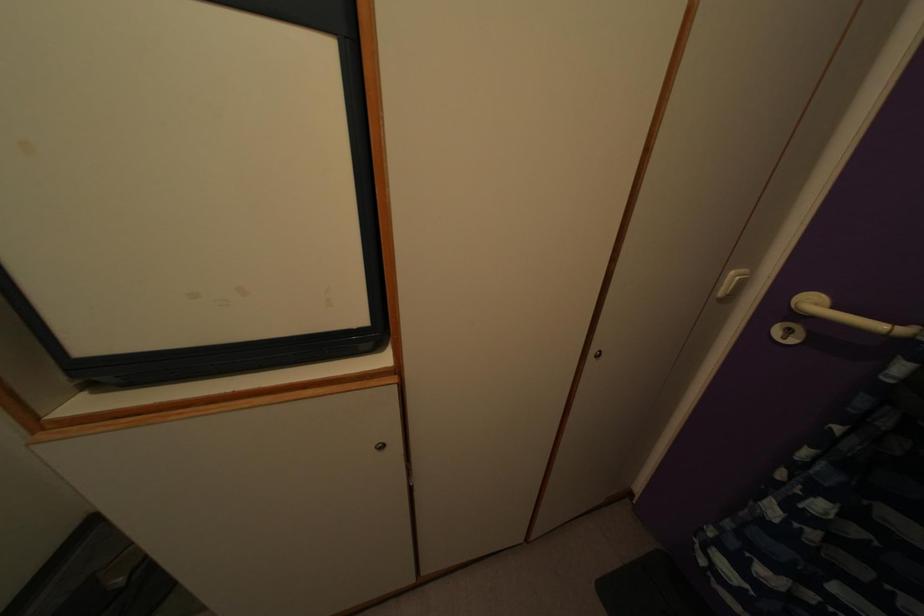
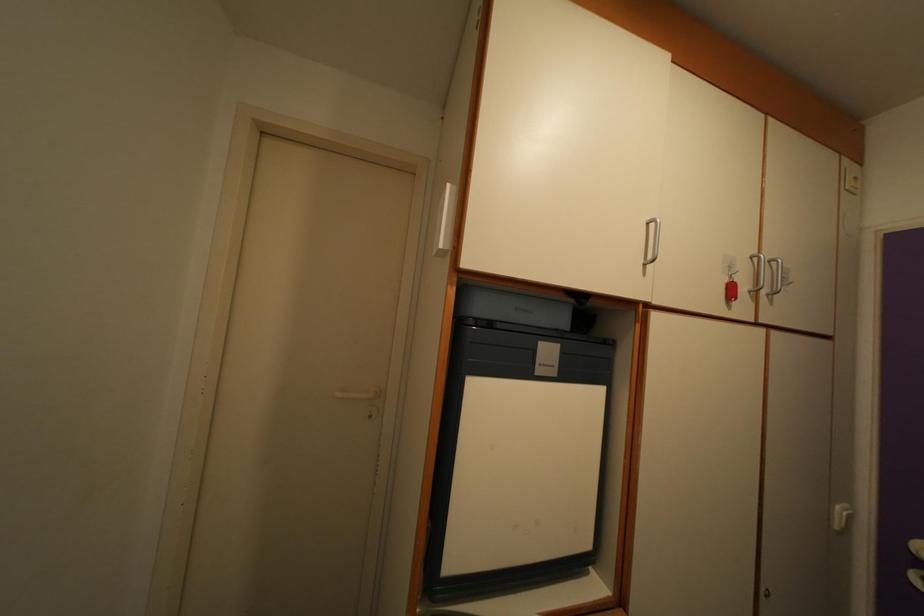
Consider the image. In a continuous first-person perspective shot, in which direction is the camera moving?

The movement direction of the cameraman is left, backward.